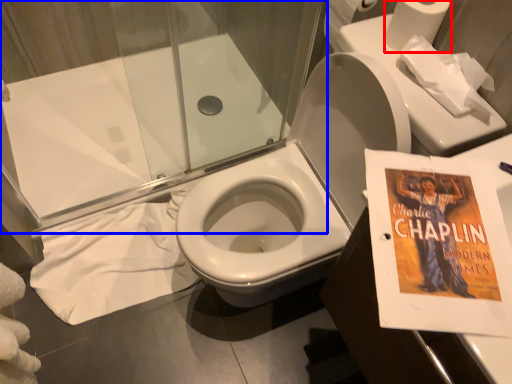
Question: Which point is closer to the camera, toilet paper (highlighted by a red box) or shower door (highlighted by a blue box)?

Choices:
 (A) toilet paper
 (B) shower door

Answer: (B)